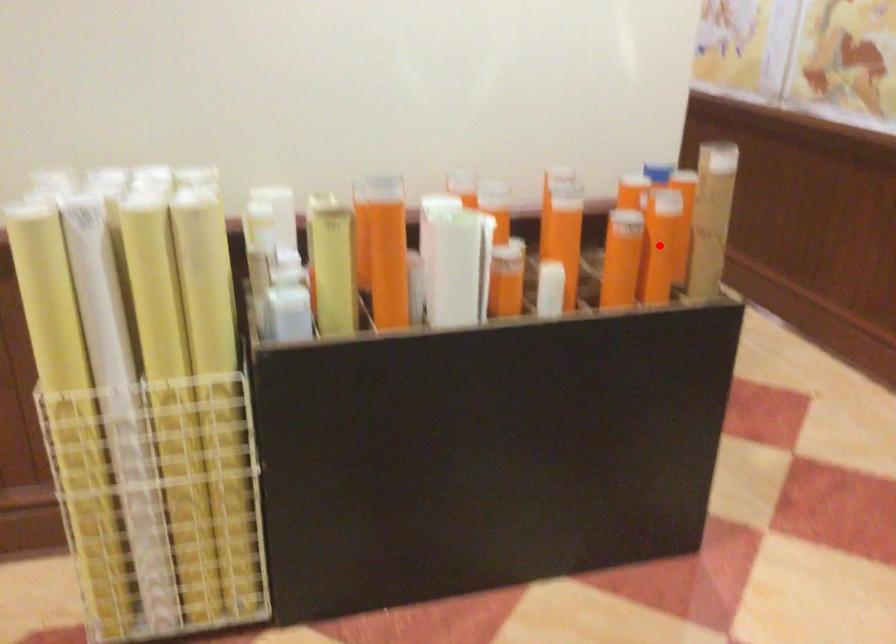
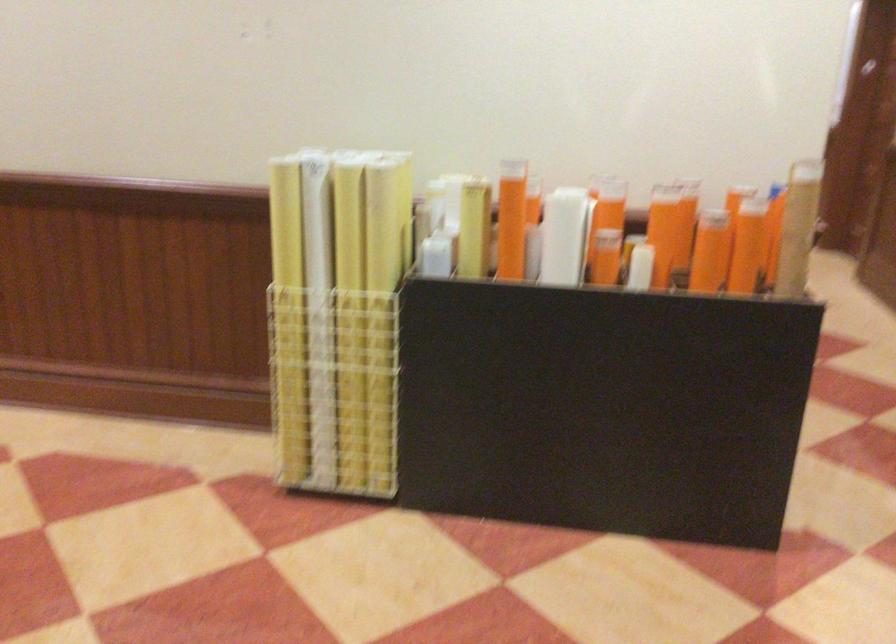
The point at the highlighted location is marked in the first image. Where is the corresponding point in the second image?

(746, 245)